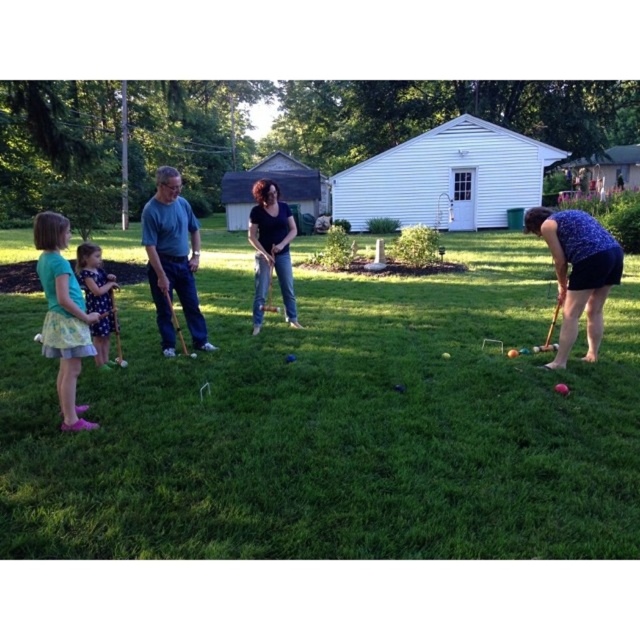
Question: Is green grass at center thinner than purple dotted dress at left?

Choices:
 (A) yes
 (B) no

Answer: (B)

Question: Which point is closer to the camera taking this photo?

Choices:
 (A) (285, 307)
 (B) (570, 248)

Answer: (B)

Question: Can you confirm if green grass at center is positioned to the right of purple dotted dress at left?

Choices:
 (A) yes
 (B) no

Answer: (A)

Question: Is blue cotton shirt at left positioned behind purple dotted dress at left?

Choices:
 (A) no
 (B) yes

Answer: (B)

Question: Which object appears closest to the camera in this image?

Choices:
 (A) green grass at center
 (B) purple fabric at lower right
 (C) dark blue shirt at center
 (D) blue cotton shirt at left

Answer: (A)

Question: Which object is closer to the camera taking this photo?

Choices:
 (A) dark blue shirt at center
 (B) green grass at center

Answer: (B)